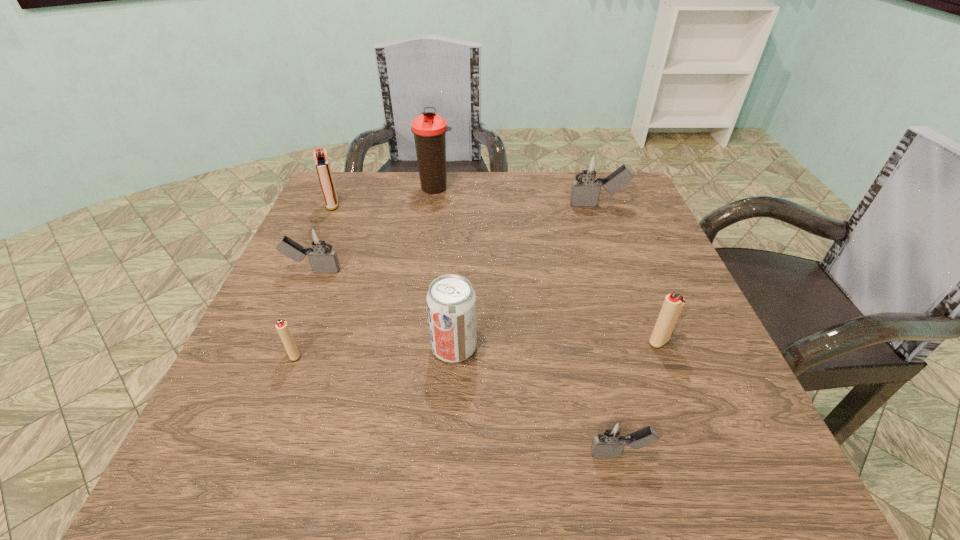
Locate an element on the screen. Image resolution: width=960 pixels, height=540 pixels. the tallest object is located at coordinates (429, 129).

I want to click on thermos bottle, so (x=429, y=129).

This screenshot has width=960, height=540. Identify the location of the biggest red igniter. pos(322,164).

Image resolution: width=960 pixels, height=540 pixels. What are the coordinates of `the leftmost red igniter` in the screenshot? It's located at (322, 164).

Locate an element on the screen. the farthest gray igniter is located at coordinates (585, 192).

Identify the location of soda can. This screenshot has height=540, width=960. (451, 303).

Identify the location of the leftmost gray igniter. Image resolution: width=960 pixels, height=540 pixels. (318, 247).

Locate an element on the screen. Image resolution: width=960 pixels, height=540 pixels. the fourth farthest object is located at coordinates [x=318, y=247].

Where is `the rightmost red igniter`? This screenshot has height=540, width=960. the rightmost red igniter is located at coordinates (672, 307).

Identify the location of the smallest red igniter. (281, 325).